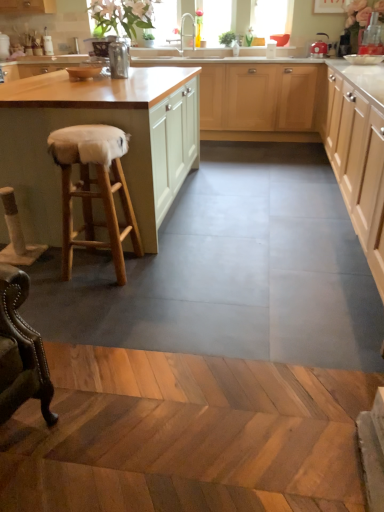
The image size is (384, 512). Describe the element at coordinates (216, 20) in the screenshot. I see `transparent glass window screen at upper center` at that location.

What do you see at coordinates (319, 49) in the screenshot? The width and height of the screenshot is (384, 512). I see `matte red kettle at upper right` at bounding box center [319, 49].

Identify the location of matte white cabinets at center, which is the 2th cabinetry in right-to-left order. The height and width of the screenshot is (512, 384). (309, 125).

I want to click on wooden stool at left, marked as the first cabinetry in a left-to-right arrangement, so click(x=97, y=123).

Where is `transparent glass window at upper center`? Image resolution: width=384 pixels, height=512 pixels. transparent glass window at upper center is located at coordinates (268, 17).

Identify the location of matte wood cabinets at right, marked as the third cabinetry in a left-to-right arrangement. coord(358,165).

Which object is closer to the camera, matte red kettle at upper right or matte wood cabinets at right, the first cabinetry positioned from the right?

matte wood cabinets at right, the first cabinetry positioned from the right, is more forward.

Considering the sizes of matte red kettle at upper right and matte wood cabinets at right, marked as the third cabinetry in a left-to-right arrangement, in the image, is matte red kettle at upper right bigger or smaller than matte wood cabinets at right, marked as the third cabinetry in a left-to-right arrangement,?

Clearly, matte red kettle at upper right is smaller in size than matte wood cabinets at right, marked as the third cabinetry in a left-to-right arrangement.

Based on the photo, in the image, is matte red kettle at upper right positioned in front of or behind transparent glass window screen at upper center?

In the image, matte red kettle at upper right appears in front of transparent glass window screen at upper center.

In the image, is matte red kettle at upper right on the left side or the right side of transparent glass window screen at upper center?

In the image, matte red kettle at upper right appears on the right side of transparent glass window screen at upper center.

Who is smaller, matte red kettle at upper right or transparent glass window screen at upper center?

matte red kettle at upper right is smaller.

Does wooden stool at left have a lesser width compared to transparent glass window at upper center?

Incorrect, the width of wooden stool at left is not less than that of transparent glass window at upper center.

Is wooden stool at left surrounding transparent glass window at upper center?

No, wooden stool at left does not contain transparent glass window at upper center.

Based on their sizes in the image, would you say wooden stool at left is bigger or smaller than transparent glass window at upper center?

In the image, wooden stool at left appears to be larger than transparent glass window at upper center.

From the image's perspective, does wooden stool at left appear higher than transparent glass window at upper center?

Incorrect, from the image's perspective, wooden stool at left is lower than transparent glass window at upper center.

The height and width of the screenshot is (512, 384). What are the coordinates of `cabinetry on the right of wooden stool at left` in the screenshot? It's located at (358, 165).

Is wooden stool at left smaller than matte wood cabinets at right, marked as the third cabinetry in a left-to-right arrangement?

Indeed, wooden stool at left has a smaller size compared to matte wood cabinets at right, marked as the third cabinetry in a left-to-right arrangement.

Considering the positions of point (66, 174) and point (379, 215), is point (66, 174) closer or farther from the camera than point (379, 215)?

Point (66, 174) is positioned closer to the camera compared to point (379, 215).

Is wooden stool at left thinner than matte wood cabinets at right, marked as the third cabinetry in a left-to-right arrangement?

Correct, the width of wooden stool at left is less than that of matte wood cabinets at right, marked as the third cabinetry in a left-to-right arrangement.

Considering the positions of points (179, 68) and (71, 134), is point (179, 68) farther from camera compared to point (71, 134)?

Yes, it is behind point (71, 134).

From the image's perspective, is wooden stool at left, the 3th cabinetry from the right, located above wooden stool at left?

Indeed, from the image's perspective, wooden stool at left, the 3th cabinetry from the right, is shown above wooden stool at left.

At what (x,y) coordinates should I click in order to perform the action: click on stool below the wooden stool at left, the 3th cabinetry from the right (from the image's perspective). Please return your answer as a coordinate pair (x, y). The width and height of the screenshot is (384, 512). Looking at the image, I should click on (94, 191).

Is matte white cabinets at center, which is the 2th cabinetry in right-to-left order, positioned in front of transparent glass window at upper center?

That is True.

Can you see matte white cabinets at center, which is the 2th cabinetry in right-to-left order, touching transparent glass window at upper center?

No, matte white cabinets at center, which is the 2th cabinetry in right-to-left order, is not making contact with transparent glass window at upper center.

Is transparent glass window at upper center located within matte white cabinets at center, which is the 2th cabinetry in right-to-left order?

No, transparent glass window at upper center is located outside of matte white cabinets at center, which is the 2th cabinetry in right-to-left order.

Between matte wood cabinets at right, the first cabinetry positioned from the right, and matte white cabinets at center, which is the 2th cabinetry in right-to-left order, which one appears on the right side from the viewer's perspective?

matte wood cabinets at right, the first cabinetry positioned from the right.

Is matte wood cabinets at right, marked as the third cabinetry in a left-to-right arrangement, with matte white cabinets at center, which is the 2th cabinetry in right-to-left order?

matte wood cabinets at right, marked as the third cabinetry in a left-to-right arrangement, and matte white cabinets at center, which is the 2th cabinetry in right-to-left order, are clearly separated.

Is matte wood cabinets at right, marked as the third cabinetry in a left-to-right arrangement, wider than matte white cabinets at center, which is the second cabinetry in left-to-right order?

No, matte wood cabinets at right, marked as the third cabinetry in a left-to-right arrangement, is not wider than matte white cabinets at center, which is the second cabinetry in left-to-right order.

This screenshot has height=512, width=384. I want to click on cabinetry that is the 1st object to the left of the matte wood cabinets at right, marked as the third cabinetry in a left-to-right arrangement, starting at the anchor, so [x=309, y=125].

The height and width of the screenshot is (512, 384). I want to click on appliance that is above the matte wood cabinets at right, marked as the third cabinetry in a left-to-right arrangement (from a real-world perspective), so click(319, 49).

You are a GUI agent. You are given a task and a screenshot of the screen. Output one action in this format:
    pyautogui.click(x=<x>, y=<y>)
    Task: Click on the appliance directly beneath the transparent glass window screen at upper center (from a real-world perspective)
    This screenshot has width=384, height=512.
    Given the screenshot: What is the action you would take?
    pyautogui.click(x=319, y=49)

Based on their spatial positions, is transparent glass window screen at upper center or wooden stool at left, marked as the first cabinetry in a left-to-right arrangement, further from matte wood cabinets at right, marked as the third cabinetry in a left-to-right arrangement?

Based on the image, transparent glass window screen at upper center appears to be further to matte wood cabinets at right, marked as the third cabinetry in a left-to-right arrangement.

Estimate the real-world distances between objects in this image. Which object is further from transparent glass window screen at upper center, matte white cabinets at center, which is the second cabinetry in left-to-right order, or wooden stool at left?

wooden stool at left lies further to transparent glass window screen at upper center than the other object.

Looking at this image, considering their positions, is matte red kettle at upper right positioned closer to wooden stool at left than matte white cabinets at center, which is the second cabinetry in left-to-right order?

The object closer to wooden stool at left is matte white cabinets at center, which is the second cabinetry in left-to-right order.

Based on their spatial positions, is matte red kettle at upper right or transparent glass window at upper center further from matte white cabinets at center, which is the second cabinetry in left-to-right order?

transparent glass window at upper center.

From the image, which object appears to be nearer to matte red kettle at upper right, wooden stool at left, marked as the first cabinetry in a left-to-right arrangement, or matte white cabinets at center, which is the second cabinetry in left-to-right order?

matte white cabinets at center, which is the second cabinetry in left-to-right order, is positioned closer to the anchor matte red kettle at upper right.

Looking at the image, which one is located closer to matte wood cabinets at right, the first cabinetry positioned from the right, wooden stool at left or wooden stool at left, marked as the first cabinetry in a left-to-right arrangement?

wooden stool at left, marked as the first cabinetry in a left-to-right arrangement, lies closer to matte wood cabinets at right, the first cabinetry positioned from the right, than the other object.

Estimate the real-world distances between objects in this image. Which object is closer to matte red kettle at upper right, transparent glass window screen at upper center or wooden stool at left, the 3th cabinetry from the right?

The object closer to matte red kettle at upper right is transparent glass window screen at upper center.

Estimate the real-world distances between objects in this image. Which object is closer to matte white cabinets at center, which is the 2th cabinetry in right-to-left order, wooden stool at left or transparent glass window at upper center?

The object closer to matte white cabinets at center, which is the 2th cabinetry in right-to-left order, is wooden stool at left.

Locate an element on the screen. This screenshot has width=384, height=512. cabinetry between wooden stool at left and matte red kettle at upper right along the z-axis is located at coordinates (97, 123).

Where is `appliance between matte white cabinets at center, which is the 2th cabinetry in right-to-left order, and transparent glass window at upper center, along the z-axis`? appliance between matte white cabinets at center, which is the 2th cabinetry in right-to-left order, and transparent glass window at upper center, along the z-axis is located at coordinates click(319, 49).

At what (x,y) coordinates should I click in order to perform the action: click on stool between matte white cabinets at center, which is the second cabinetry in left-to-right order, and matte wood cabinets at right, marked as the third cabinetry in a left-to-right arrangement. Please return your answer as a coordinate pair (x, y). Looking at the image, I should click on (94, 191).

What are the coordinates of `stool between matte wood cabinets at right, marked as the third cabinetry in a left-to-right arrangement, and transparent glass window screen at upper center from front to back` in the screenshot? It's located at [94, 191].